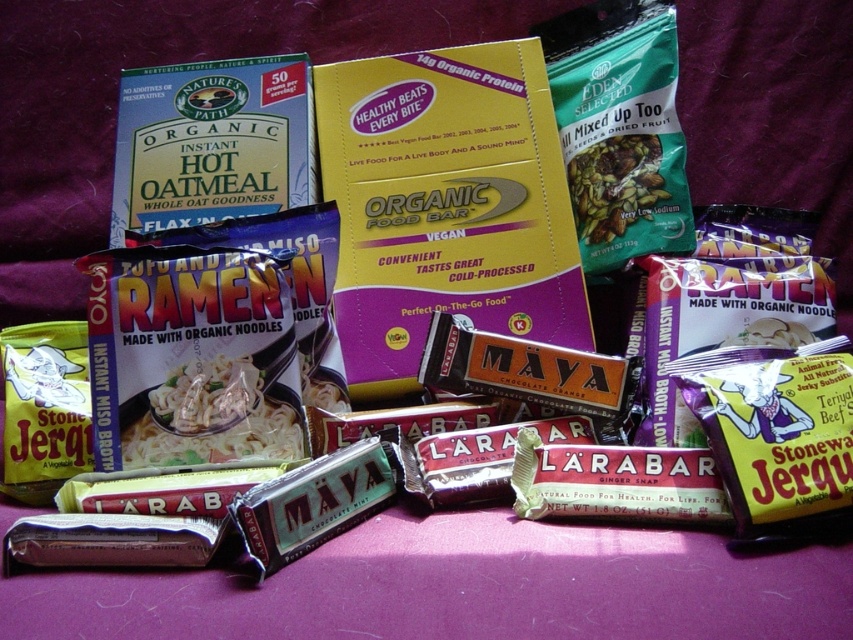
Is point (703, 477) more distant than point (624, 225)?

No, it is not.

Is chocolate bar at center above green matte snack mix at center?

Actually, chocolate bar at center is below green matte snack mix at center.

Describe the element at coordinates (614, 481) in the screenshot. I see `chocolate bar at center` at that location.

At what (x,y) coordinates should I click in order to perform the action: click on chocolate bar at center. Please return your answer as a coordinate pair (x, y). This screenshot has width=853, height=640. Looking at the image, I should click on (614, 481).